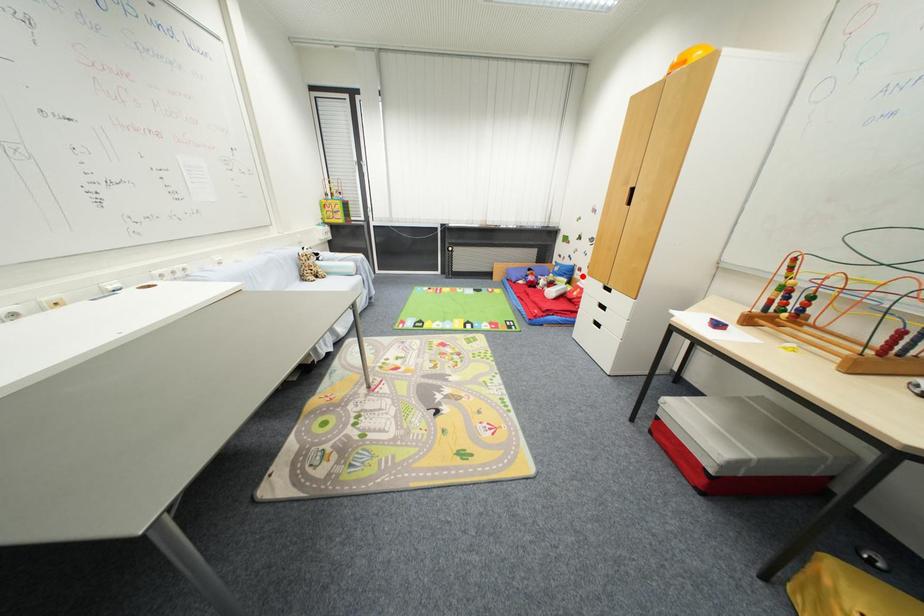
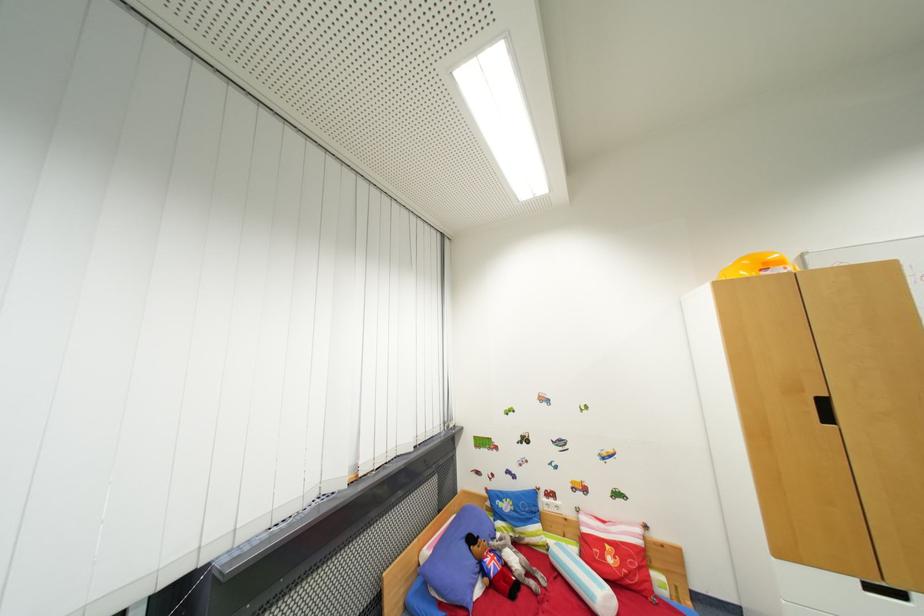
Find the pixel in the second image that matches the highlighted location in the first image.

(550, 506)